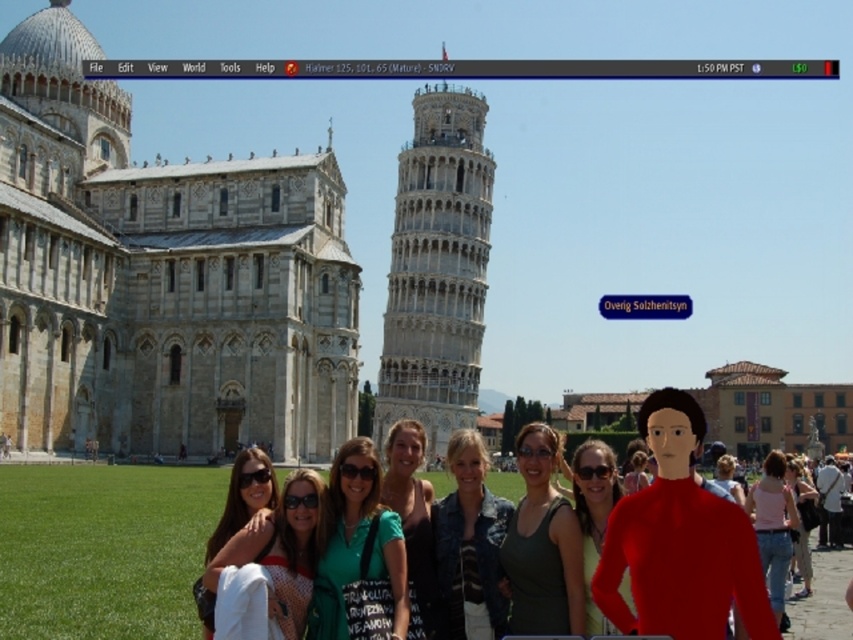
Who is positioned more to the right, green fabric dress at center or matte black sunglasses at lower left?

green fabric dress at center

Based on the photo, which is below, green fabric dress at center or matte black sunglasses at lower left?

green fabric dress at center

Find the location of `green fabric dress at center`. green fabric dress at center is located at coordinates (412, 512).

Who is lower down, green fabric dress at center or denim jeans at lower right?

denim jeans at lower right

In the scene shown: Is the position of green fabric dress at center more distant than that of denim jeans at lower right?

No, it is in front of denim jeans at lower right.

Is point (432, 550) farther from camera compared to point (810, 586)?

No, (432, 550) is in front of (810, 586).

Identify the location of green fabric dress at center. (412, 512).

Can you confirm if matte red shirt at center is shorter than white fabric bag at lower right?

No.

Between matte red shirt at center and white fabric bag at lower right, which one is positioned higher?

matte red shirt at center is above.

Identify the location of matte red shirt at center. (593, 515).

This screenshot has height=640, width=853. Identify the location of matte red shirt at center. (593, 515).